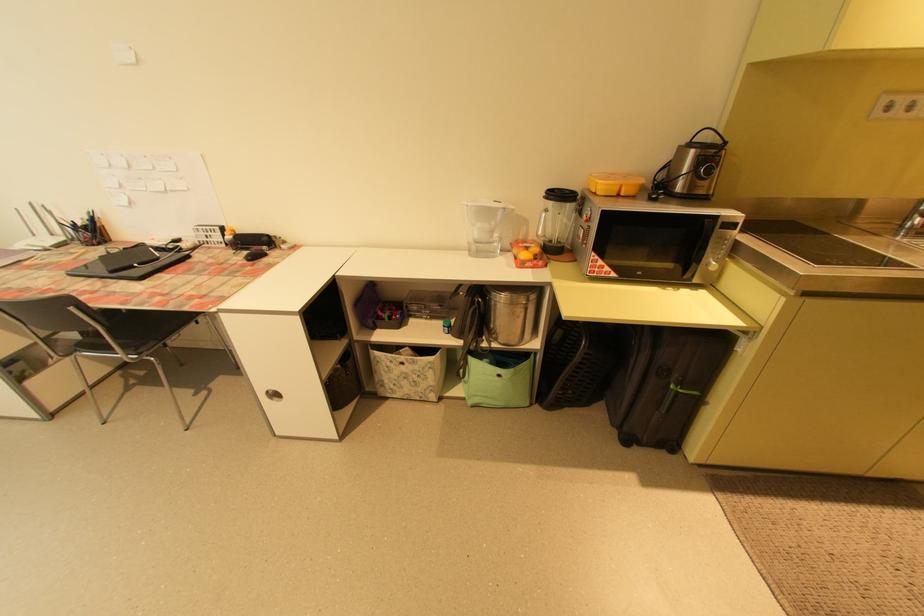
Find where to lift the water pitcher handle. Please return your answer as a coordinate pair (x, y).

(508, 227)